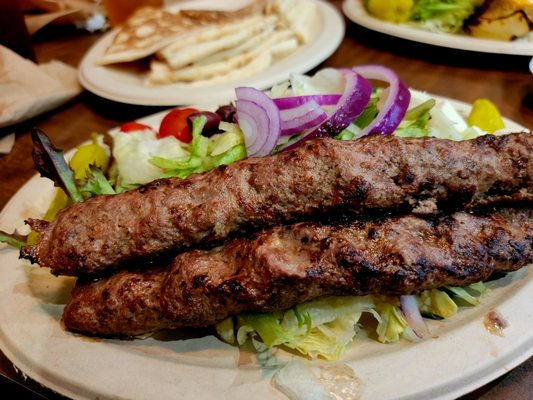
This screenshot has height=400, width=533. Find the location of `cup`. cup is located at coordinates (114, 15).